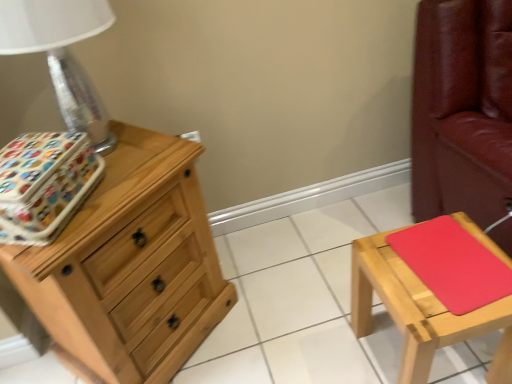
The width and height of the screenshot is (512, 384). In order to click on empty space that is ontop of red matte pad at right (from a real-world perspective) in this screenshot , I will do `click(453, 255)`.